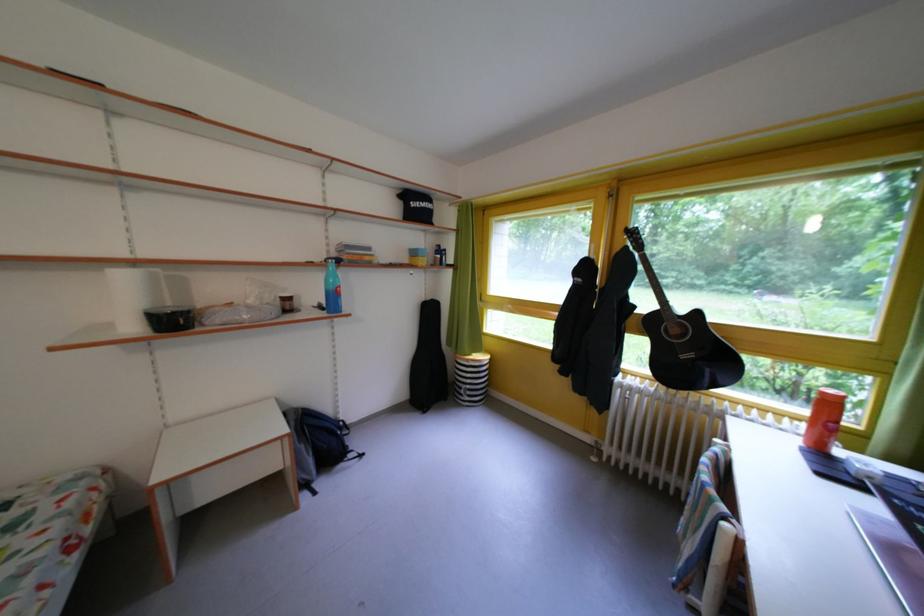
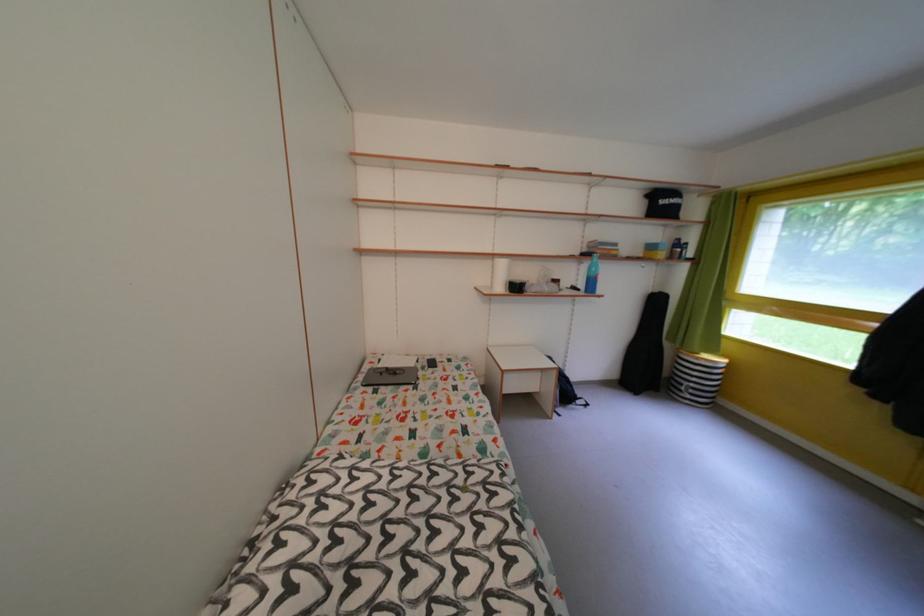
In the second image, find the point that corresponds to (x=439, y=304) in the first image.

(665, 296)